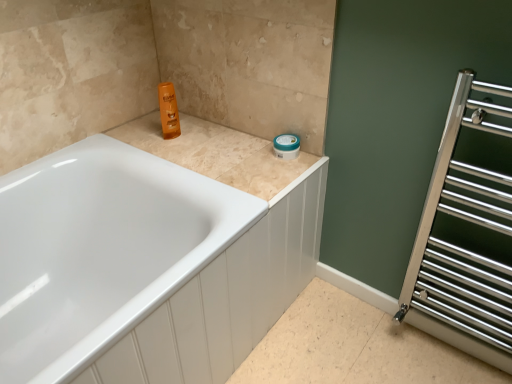
Question: Should I look upward or downward to see beige tile counter top at upper center?

Choices:
 (A) up
 (B) down

Answer: (A)

Question: Should I look upward or downward to see white glossy bathtub at upper left?

Choices:
 (A) up
 (B) down

Answer: (B)

Question: From the image's perspective, is white glossy bathtub at upper left below beige tile counter top at upper center?

Choices:
 (A) yes
 (B) no

Answer: (A)

Question: From the image's perspective, is white glossy bathtub at upper left on beige tile counter top at upper center?

Choices:
 (A) yes
 (B) no

Answer: (B)

Question: Is white glossy bathtub at upper left completely or partially outside of beige tile counter top at upper center?

Choices:
 (A) no
 (B) yes

Answer: (B)

Question: Is white glossy bathtub at upper left not near beige tile counter top at upper center?

Choices:
 (A) no
 (B) yes

Answer: (A)

Question: Is white glossy bathtub at upper left at the left side of beige tile counter top at upper center?

Choices:
 (A) yes
 (B) no

Answer: (A)

Question: Is white glossy bathtub at upper left oriented away from beige tile counter top at upper center?

Choices:
 (A) yes
 (B) no

Answer: (B)

Question: Can you confirm if polished chrome towel rack at right is thinner than white glossy bathtub at upper left?

Choices:
 (A) yes
 (B) no

Answer: (A)

Question: Is polished chrome towel rack at right bigger than white glossy bathtub at upper left?

Choices:
 (A) yes
 (B) no

Answer: (B)

Question: Is polished chrome towel rack at right outside white glossy bathtub at upper left?

Choices:
 (A) yes
 (B) no

Answer: (A)

Question: Is polished chrome towel rack at right beside white glossy bathtub at upper left?

Choices:
 (A) yes
 (B) no

Answer: (B)

Question: From a real-world perspective, is polished chrome towel rack at right over white glossy bathtub at upper left?

Choices:
 (A) no
 (B) yes

Answer: (B)

Question: Considering the relative positions of polished chrome towel rack at right and white glossy bathtub at upper left in the image provided, is polished chrome towel rack at right to the right of white glossy bathtub at upper left from the viewer's perspective?

Choices:
 (A) no
 (B) yes

Answer: (B)

Question: Are polished chrome towel rack at right and beige tile counter top at upper center beside each other?

Choices:
 (A) yes
 (B) no

Answer: (B)